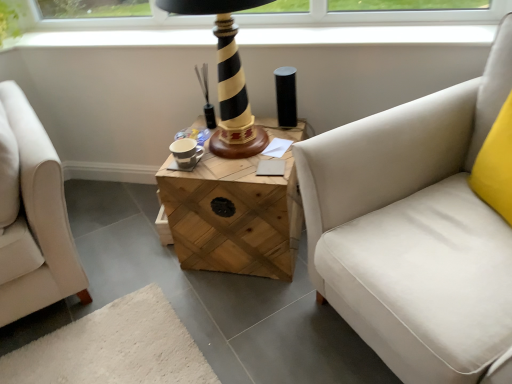
Question: Is black striped wood table lamp at center to the left of white fabric studio couch at right from the viewer's perspective?

Choices:
 (A) no
 (B) yes

Answer: (B)

Question: Is black striped wood table lamp at center touching white fabric studio couch at right?

Choices:
 (A) no
 (B) yes

Answer: (A)

Question: From a real-world perspective, is black striped wood table lamp at center physically below white fabric studio couch at right?

Choices:
 (A) yes
 (B) no

Answer: (B)

Question: Considering the relative sizes of black striped wood table lamp at center and white fabric studio couch at right in the image provided, is black striped wood table lamp at center thinner than white fabric studio couch at right?

Choices:
 (A) no
 (B) yes

Answer: (B)

Question: Does black striped wood table lamp at center come behind white fabric studio couch at right?

Choices:
 (A) yes
 (B) no

Answer: (A)

Question: Based on their positions, is wooden crate at center located to the left or right of black striped wood table lamp at center?

Choices:
 (A) right
 (B) left

Answer: (A)

Question: From a real-world perspective, relative to black striped wood table lamp at center, is wooden crate at center vertically above or below?

Choices:
 (A) below
 (B) above

Answer: (A)

Question: Is wooden crate at center wider or thinner than black striped wood table lamp at center?

Choices:
 (A) thin
 (B) wide

Answer: (B)

Question: Is point (209, 251) positioned closer to the camera than point (225, 62)?

Choices:
 (A) closer
 (B) farther

Answer: (B)

Question: From the image's perspective, is wooden crate at center above or below white fabric studio couch at right?

Choices:
 (A) below
 (B) above

Answer: (B)

Question: Is wooden crate at center taller or shorter than white fabric studio couch at right?

Choices:
 (A) tall
 (B) short

Answer: (B)

Question: Is wooden crate at center inside the boundaries of white fabric studio couch at right, or outside?

Choices:
 (A) outside
 (B) inside

Answer: (A)

Question: Looking at the image, does wooden crate at center seem bigger or smaller compared to white fabric studio couch at right?

Choices:
 (A) big
 (B) small

Answer: (B)

Question: From the image's perspective, relative to white fabric studio couch at right, is black striped wood table lamp at center above or below?

Choices:
 (A) above
 (B) below

Answer: (A)

Question: Considering the positions of black striped wood table lamp at center and white fabric studio couch at right in the image, is black striped wood table lamp at center taller or shorter than white fabric studio couch at right?

Choices:
 (A) short
 (B) tall

Answer: (A)